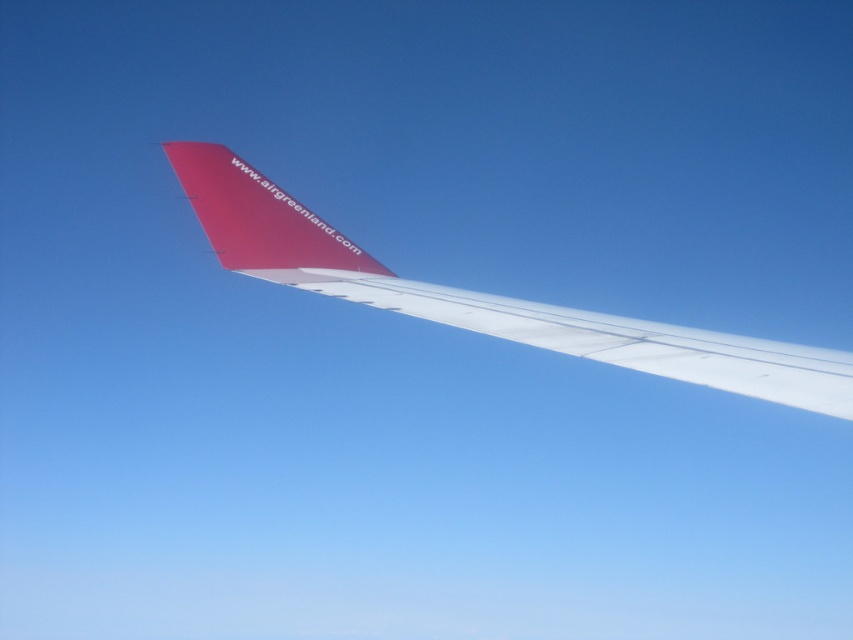
Question: Which point appears farthest from the camera in this image?

Choices:
 (A) 337,285
 (B) 680,365

Answer: (A)

Question: Is white matte wing at center closer to camera compared to smooth red airplane tail at upper center?

Choices:
 (A) no
 (B) yes

Answer: (B)

Question: Is white matte wing at center positioned in front of smooth red airplane tail at upper center?

Choices:
 (A) no
 (B) yes

Answer: (B)

Question: Among these points, which one is farthest from the camera?

Choices:
 (A) (737, 380)
 (B) (527, 332)
 (C) (241, 243)

Answer: (C)

Question: Observing the image, what is the correct spatial positioning of white matte wing at center in reference to smooth red airplane tail at upper center?

Choices:
 (A) below
 (B) above

Answer: (A)

Question: Which point is closer to the camera?

Choices:
 (A) (733, 381)
 (B) (299, 252)

Answer: (A)